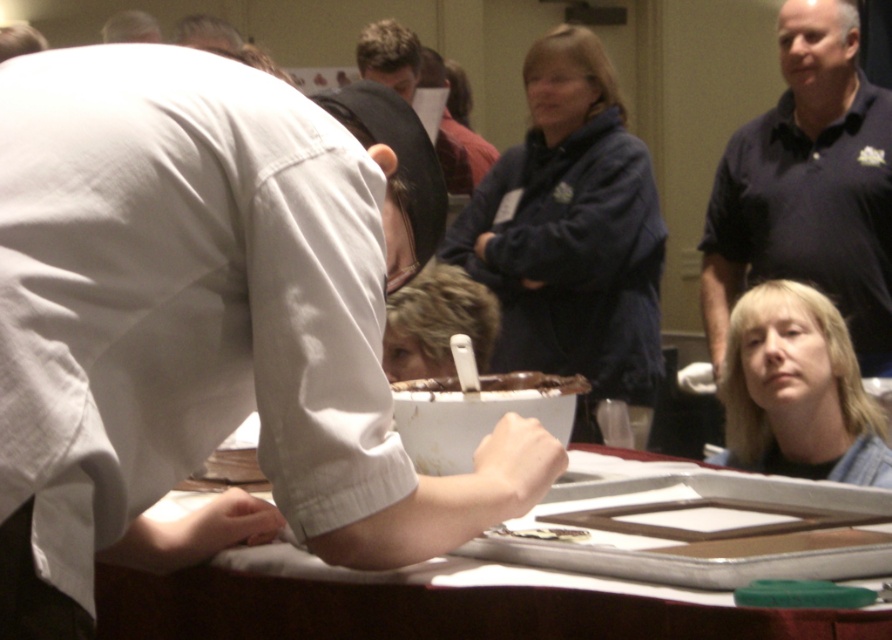
This screenshot has height=640, width=892. Find the location of `white glossy tray at center`. white glossy tray at center is located at coordinates (428, 611).

Identify the location of white glossy tray at center. (428, 611).

Does dark blue polo shirt at upper right appear over blonde hair at lower right?

Yes, dark blue polo shirt at upper right is above blonde hair at lower right.

Does dark blue polo shirt at upper right lie in front of blonde hair at lower right?

No, dark blue polo shirt at upper right is behind blonde hair at lower right.

Identify the location of dark blue polo shirt at upper right. The width and height of the screenshot is (892, 640). (808, 186).

Does blonde hair at lower right have a smaller size compared to blonde hair at center?

No.

Can you confirm if blonde hair at lower right is bigger than blonde hair at center?

Yes, blonde hair at lower right is bigger than blonde hair at center.

Locate an element on the screen. The width and height of the screenshot is (892, 640). blonde hair at lower right is located at coordinates (797, 392).

Where is `blonde hair at lower right`? blonde hair at lower right is located at coordinates (797, 392).